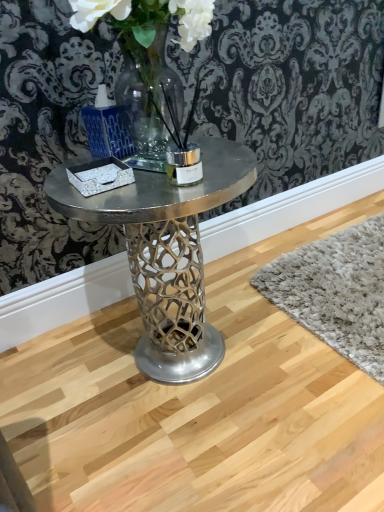
In order to face metallic silver table at center, should I rotate leftwards or rightwards?

To face it directly, rotate left by 4.464 degrees.

At what (x,y) coordinates should I click in order to perform the action: click on metallic silver table at center. Please return your answer as a coordinate pair (x, y). This screenshot has width=384, height=512. Looking at the image, I should click on (166, 253).

The width and height of the screenshot is (384, 512). What do you see at coordinates (166, 253) in the screenshot?
I see `metallic silver table at center` at bounding box center [166, 253].

This screenshot has height=512, width=384. I want to click on metallic silver table at center, so click(166, 253).